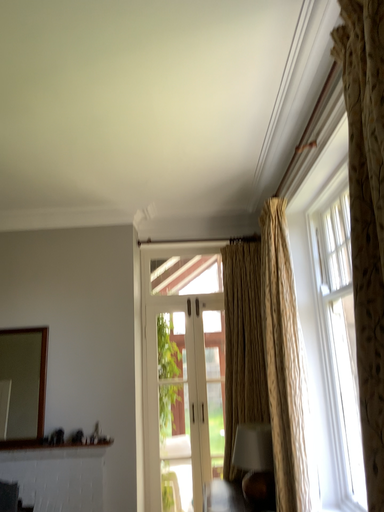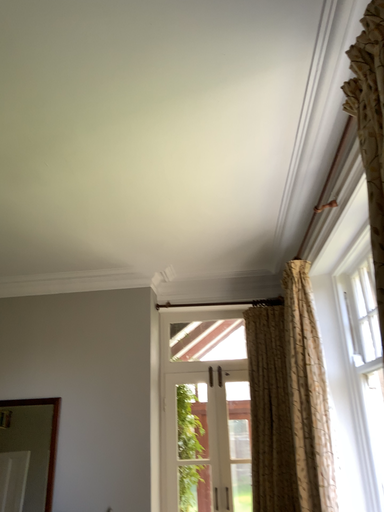
Question: How did the camera likely rotate when shooting the video?

Choices:
 (A) rotated downward
 (B) rotated upward

Answer: (B)